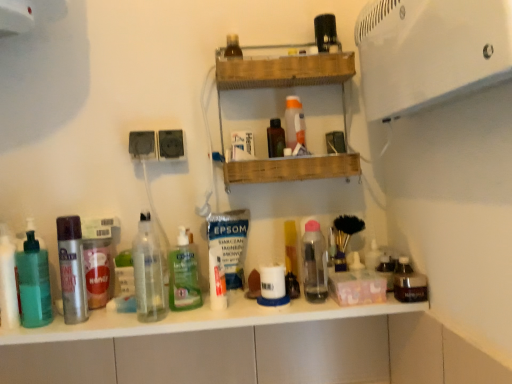
Image resolution: width=512 pixels, height=384 pixels. Find the location of `free location to the right of translucent green pump bottle at left, which appears as the third toiletry when ordered from the bottom`. free location to the right of translucent green pump bottle at left, which appears as the third toiletry when ordered from the bottom is located at coordinates (73, 329).